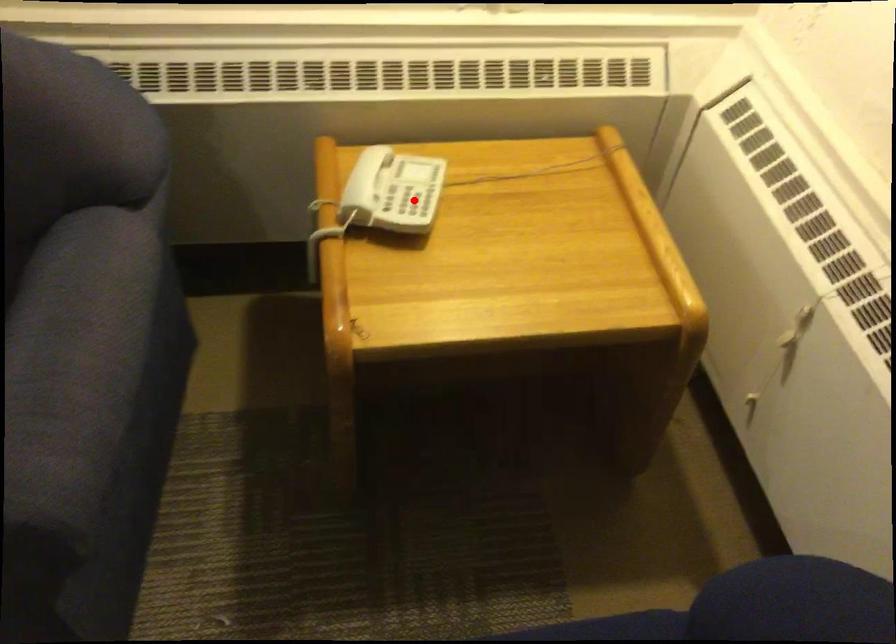
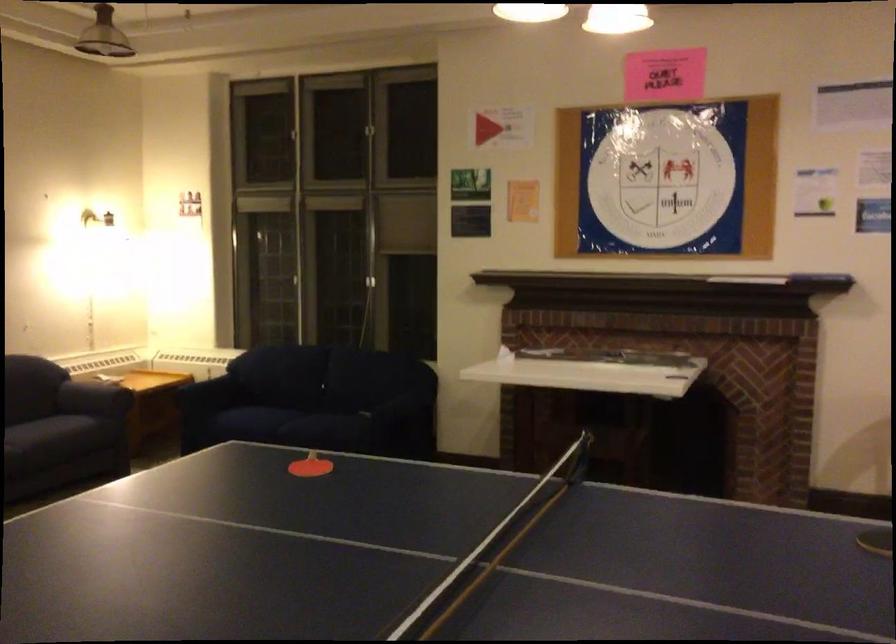
Question: I am providing you with two images of the same scene from different viewpoints. A red point is marked on the first image. At the location where the point appears in image 1, is it still visible in image 2?

Choices:
 (A) Yes
 (B) No

Answer: (B)